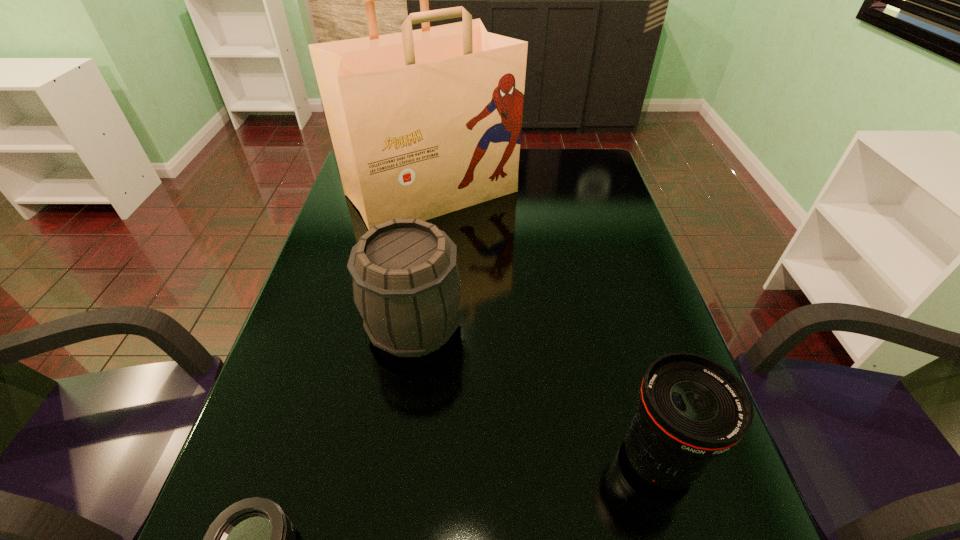
Find the location of a particular element. the tallest object is located at coordinates (425, 122).

You are a GUI agent. You are given a task and a screenshot of the screen. Output one action in this format:
    pyautogui.click(x=<x>, y=<y>)
    Task: Click on the grocery bag
    This screenshot has height=540, width=960.
    Given the screenshot: What is the action you would take?
    pyautogui.click(x=425, y=122)

Where is `wine bucket`? This screenshot has height=540, width=960. wine bucket is located at coordinates (406, 285).

Image resolution: width=960 pixels, height=540 pixels. Find the location of `the farther telephoto lens`. the farther telephoto lens is located at coordinates (691, 409).

Image resolution: width=960 pixels, height=540 pixels. What are the coordinates of `the rightmost object` in the screenshot? It's located at (691, 409).

Identify the location of vacant space situated 0.350m on the side of the farthest object with the superhero design. The width and height of the screenshot is (960, 540). (412, 336).

Where is `free space located 0.240m on the front of the second farthest object`? free space located 0.240m on the front of the second farthest object is located at coordinates (393, 483).

Find the location of a particular element. free space located 0.190m on the left of the farther telephoto lens is located at coordinates (512, 458).

I want to click on object that is at the far edge, so click(425, 122).

The width and height of the screenshot is (960, 540). Find the location of `object at the left edge`. object at the left edge is located at coordinates (425, 122).